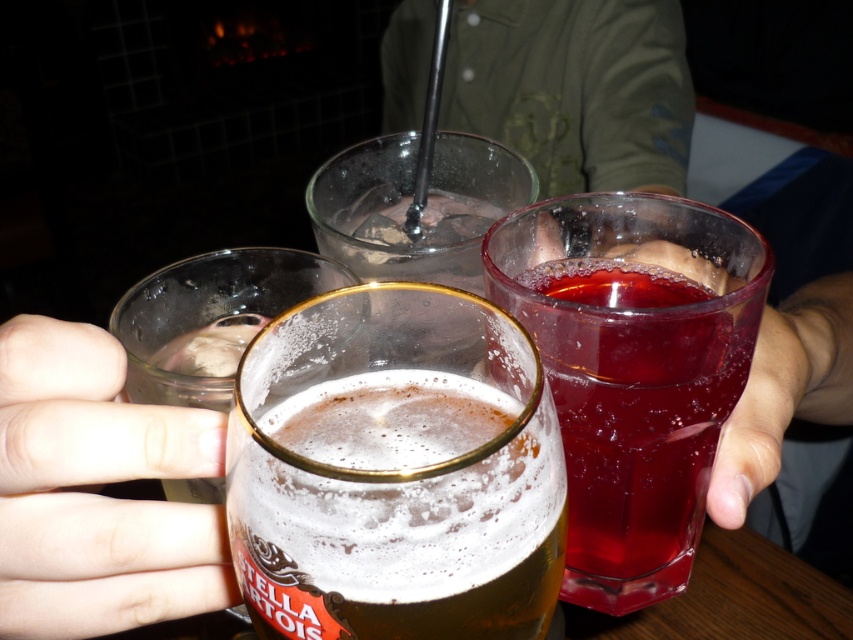
Question: Based on their relative distances, which object is farther from the clear plastic glass at lower right?

Choices:
 (A) white matte glass at lower left
 (B) foamy golden beer at center
 (C) clear glass at center
 (D) translucent glass at center

Answer: (A)

Question: Estimate the real-world distances between objects in this image. Which object is farther from the clear plastic glass at lower right?

Choices:
 (A) clear glass at center
 (B) foamy golden beer at center
 (C) white matte glass at lower left

Answer: (C)

Question: Which point appears closest to the camera in this image?

Choices:
 (A) (45, 605)
 (B) (477, 502)

Answer: (B)

Question: Is foamy golden beer at center wider than clear glass at center?

Choices:
 (A) no
 (B) yes

Answer: (A)

Question: Can you confirm if clear glass at center is bigger than clear plastic glass at lower right?

Choices:
 (A) no
 (B) yes

Answer: (B)

Question: Is foamy golden beer at center below white matte glass at lower left?

Choices:
 (A) no
 (B) yes

Answer: (A)